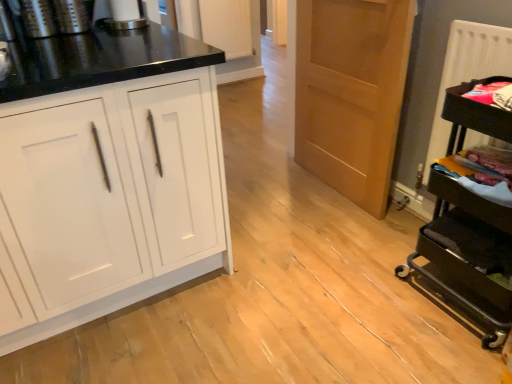
Question: Is light brown wood door at center oriented towards black metal cart at right, the first appliance from the bottom?

Choices:
 (A) yes
 (B) no

Answer: (B)

Question: Is light brown wood door at center looking in the opposite direction of black metal cart at right, acting as the 4th appliance starting from the left?

Choices:
 (A) no
 (B) yes

Answer: (A)

Question: Does light brown wood door at center have a smaller size compared to black metal cart at right, the 4th appliance from the top?

Choices:
 (A) yes
 (B) no

Answer: (A)

Question: Is light brown wood door at center bigger than black metal cart at right, the first appliance from the bottom?

Choices:
 (A) no
 (B) yes

Answer: (A)

Question: From the image's perspective, is light brown wood door at center under black metal cart at right, acting as the 4th appliance starting from the left?

Choices:
 (A) no
 (B) yes

Answer: (A)

Question: Does light brown wood door at center have a greater width compared to black metal cart at right, acting as the 4th appliance starting from the left?

Choices:
 (A) yes
 (B) no

Answer: (B)

Question: Can you confirm if brushed metal coffee grinder at upper left, acting as the 4th appliance starting from the right, is smaller than white glossy cabinet at left?

Choices:
 (A) no
 (B) yes

Answer: (B)

Question: Is brushed metal coffee grinder at upper left, which is counted as the first appliance, starting from the left, bigger than white glossy cabinet at left?

Choices:
 (A) yes
 (B) no

Answer: (B)

Question: From the image's perspective, is brushed metal coffee grinder at upper left, which is counted as the third appliance, starting from the top, on white glossy cabinet at left?

Choices:
 (A) no
 (B) yes

Answer: (B)

Question: Could you tell me if brushed metal coffee grinder at upper left, acting as the 4th appliance starting from the right, is turned towards white glossy cabinet at left?

Choices:
 (A) yes
 (B) no

Answer: (B)

Question: Does brushed metal coffee grinder at upper left, which is counted as the third appliance, starting from the top, appear on the left side of white glossy cabinet at left?

Choices:
 (A) no
 (B) yes

Answer: (B)

Question: From a real-world perspective, is brushed metal coffee grinder at upper left, which is counted as the first appliance, starting from the left, below white glossy cabinet at left?

Choices:
 (A) yes
 (B) no

Answer: (B)

Question: From a real-world perspective, is white textured radiator at right located beneath white glossy paper towel dispenser at upper center, the 3th appliance in the left-to-right sequence?

Choices:
 (A) yes
 (B) no

Answer: (A)